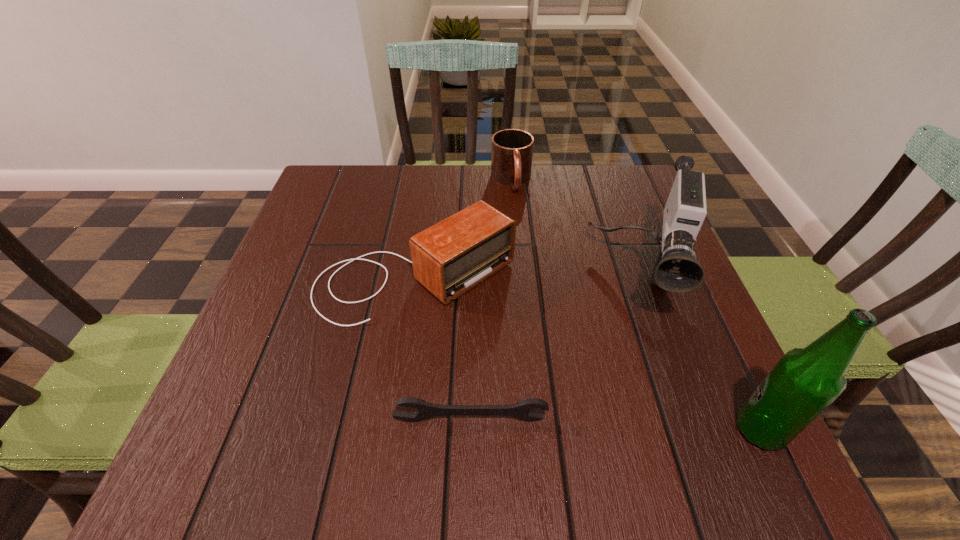
Identify the location of free space located 0.320m on the side of the mug with the handle. The image size is (960, 540). (538, 286).

Identify the location of vacant space located 0.190m on the front-facing side of the radio receiver. (555, 375).

Where is `vacant space situated 0.270m on the front-facing side of the radio receiver`? The width and height of the screenshot is (960, 540). vacant space situated 0.270m on the front-facing side of the radio receiver is located at coordinates (592, 406).

This screenshot has height=540, width=960. Identify the location of free space located on the front-facing side of the radio receiver. (568, 386).

Identify the location of object that is positioned at the far edge. The height and width of the screenshot is (540, 960). (512, 149).

Where is `wrench that is at the near edge`? The width and height of the screenshot is (960, 540). wrench that is at the near edge is located at coordinates (522, 409).

In order to click on beer bottle located at the near edge in this screenshot , I will do `click(805, 381)`.

At what (x,y) coordinates should I click in order to perform the action: click on object that is positioned at the left edge. Please return your answer as a coordinate pair (x, y). Looking at the image, I should click on (449, 258).

Where is `beer bottle that is at the right edge`? beer bottle that is at the right edge is located at coordinates (805, 381).

Find the location of a particular element. This screenshot has height=540, width=960. camcorder located at the right edge is located at coordinates (676, 270).